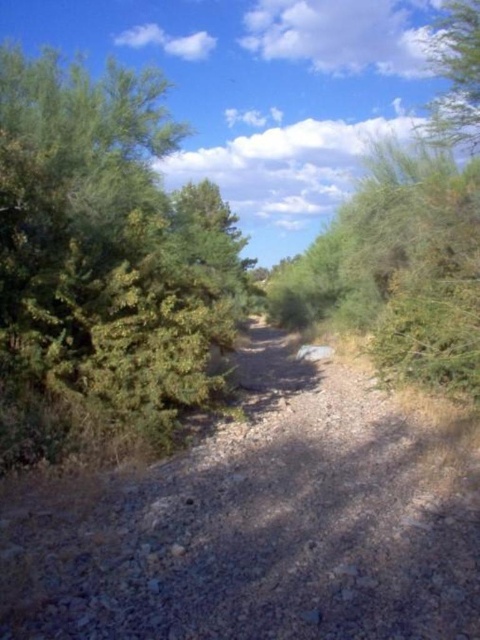
You are a hiker carrying a heavy backpack and need to cross the path. Considering the height differences between the dusty gravel path at center and the green leafy bush at left, which one would be easier to step over?

The dusty gravel path at center has a lesser height compared to the green leafy bush at left, so it would be easier to step over the dusty gravel path at center.

You are standing at the starting point of the dusty gravel path at center. If you walk straight ahead along the path, where will you end up? Please provide the coordinates in the image plane based on the given information.

The dusty gravel path at center leads to the coordinates point at (261, 525) in the image plane.